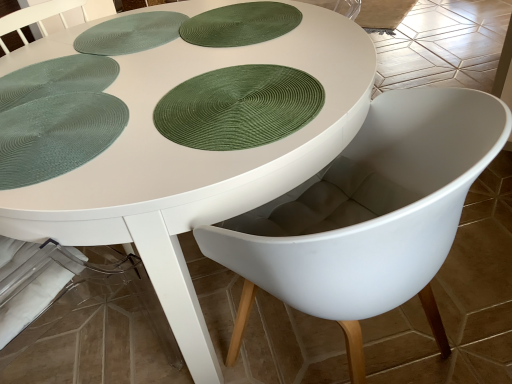
The image size is (512, 384). Identify the location of free space in front of green textured placemat at upper center, the 1th paper plate viewed from the top. (244, 75).